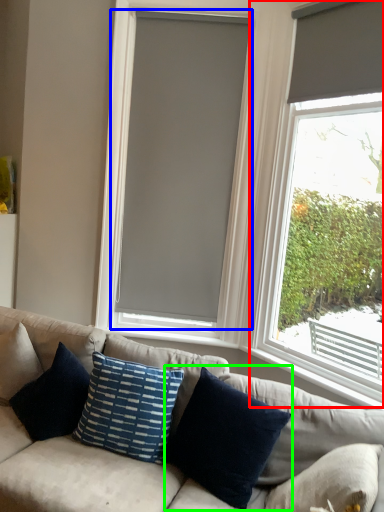
Question: Considering the real-world distances, which object is farthest from window (highlighted by a red box)? window blind (highlighted by a blue box) or pillow (highlighted by a green box)?

Choices:
 (A) window blind
 (B) pillow

Answer: (B)